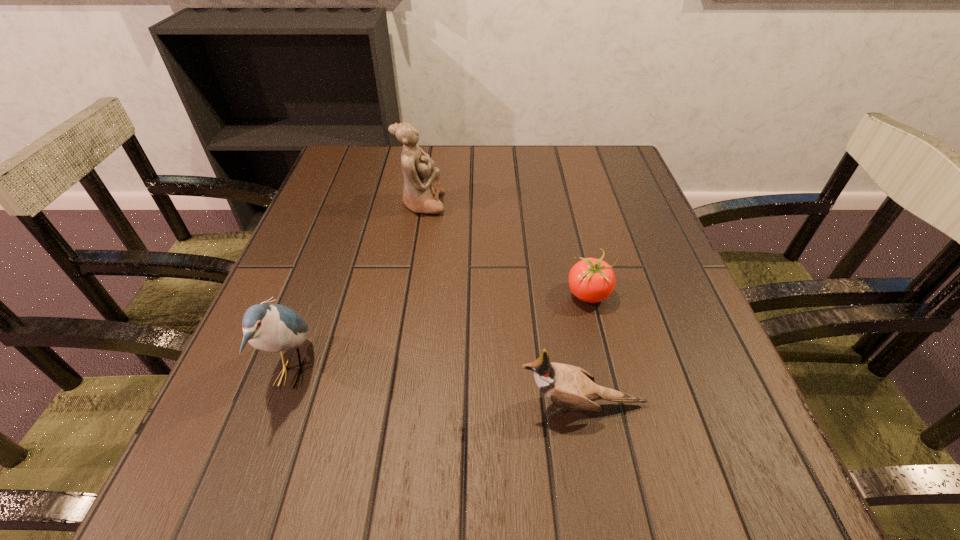
This screenshot has height=540, width=960. Identify the location of the tallest object. (422, 187).

The width and height of the screenshot is (960, 540). Identify the location of figurine. (422, 187).

The width and height of the screenshot is (960, 540). I want to click on the left bird, so click(271, 327).

At what (x,y) coordinates should I click in order to perform the action: click on the taller bird. Please return your answer as a coordinate pair (x, y). Image resolution: width=960 pixels, height=540 pixels. Looking at the image, I should click on coord(271,327).

Where is `the shorter bird`? the shorter bird is located at coordinates (567, 385).

The height and width of the screenshot is (540, 960). Find the location of `the right bird`. the right bird is located at coordinates (567, 385).

Image resolution: width=960 pixels, height=540 pixels. Identify the location of the shortest object. (591, 280).

Image resolution: width=960 pixels, height=540 pixels. Find the location of `tomato`. tomato is located at coordinates (591, 280).

Locate an element on the screen. free space located on the front-facing side of the figurine is located at coordinates (503, 204).

Identify the location of vacant space located at the tip of the third shortest object's beak. The image size is (960, 540). (558, 373).